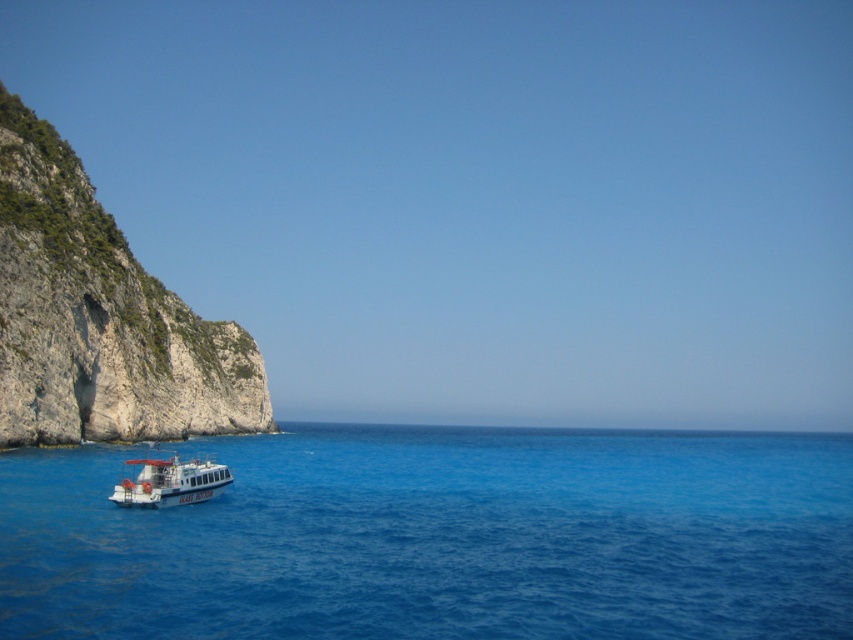
Between blue liquid water at lower left and white glossy boat at lower left, which one is positioned lower?

Positioned lower is blue liquid water at lower left.

Find the location of a particular element. This screenshot has width=853, height=640. blue liquid water at lower left is located at coordinates (440, 538).

Which is in front, point (460, 493) or point (216, 493)?

Point (216, 493) is in front.

In order to click on blue liquid water at lower left in this screenshot , I will do `click(440, 538)`.

Is the position of blue liquid water at lower left more distant than that of rugged stone cliff at left?

No, it is in front of rugged stone cliff at left.

Between point (622, 545) and point (219, 339), which one is positioned behind?

Point (219, 339)

Find the location of `blue liquid water at lower left`. blue liquid water at lower left is located at coordinates (440, 538).

Which of these two, rugged stone cliff at left or white glossy boat at lower left, stands shorter?

Standing shorter between the two is white glossy boat at lower left.

Is point (241, 358) positioned in front of point (152, 486)?

No, it is not.

Who is more distant from viewer, (x=90, y=209) or (x=138, y=483)?

The point (x=90, y=209) is more distant.

Identify the location of rugged stone cliff at left. (99, 317).